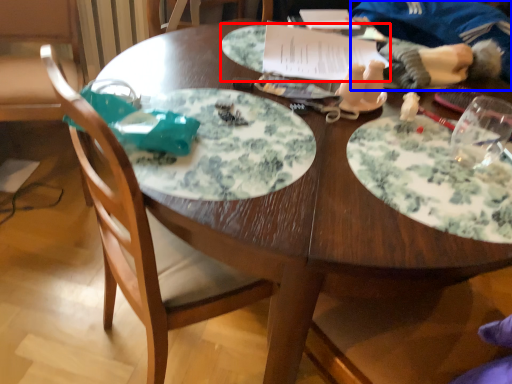
Question: Among these objects, which one is farthest to the camera, platter (highlighted by a red box) or person (highlighted by a blue box)?

Choices:
 (A) platter
 (B) person

Answer: (A)